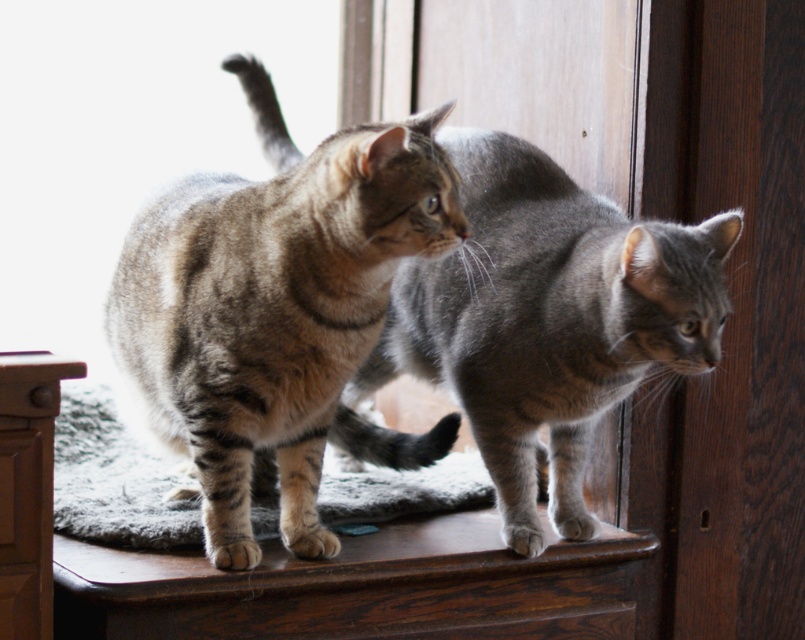
Question: Can you confirm if tabby fur cat at center is positioned to the left of gray tabby cat at center?

Choices:
 (A) no
 (B) yes

Answer: (B)

Question: Can you confirm if tabby fur cat at center is positioned below gray tabby cat at center?

Choices:
 (A) yes
 (B) no

Answer: (A)

Question: Which object appears closest to the camera in this image?

Choices:
 (A) gray tabby cat at center
 (B) tabby fur cat at center

Answer: (B)

Question: Does tabby fur cat at center have a larger size compared to gray tabby cat at center?

Choices:
 (A) yes
 (B) no

Answer: (B)